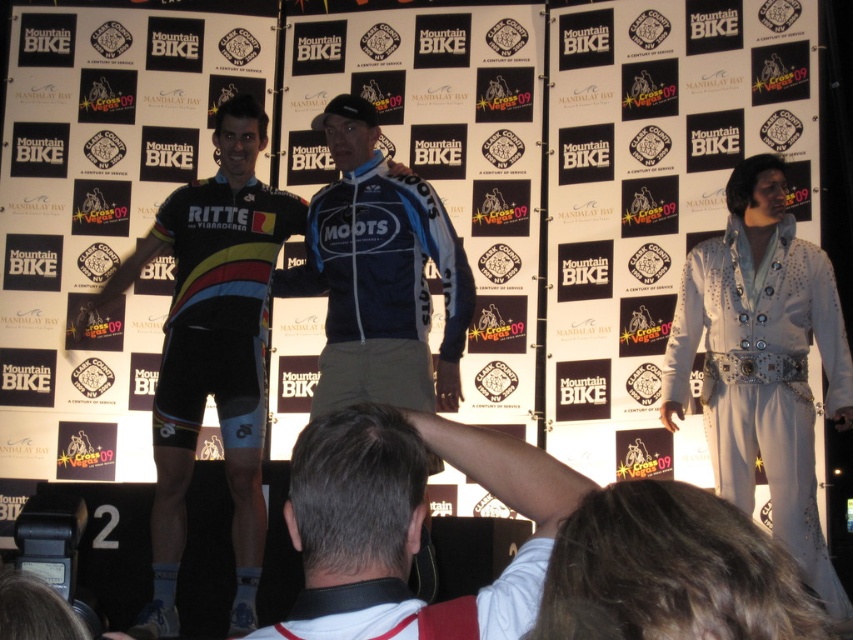
Can you confirm if white satin suit at right is positioned to the right of white cotton shirt at center?

Indeed, white satin suit at right is positioned on the right side of white cotton shirt at center.

Does white satin suit at right have a greater width compared to white cotton shirt at center?

In fact, white satin suit at right might be narrower than white cotton shirt at center.

Locate an element on the screen. The height and width of the screenshot is (640, 853). white satin suit at right is located at coordinates (763, 362).

Find the location of a particular element. white satin suit at right is located at coordinates (763, 362).